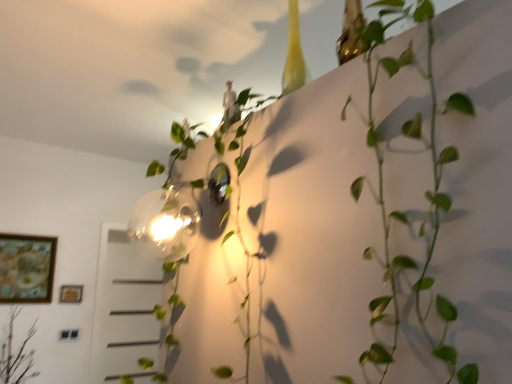
Question: Can you confirm if green leafy plant at upper center, the second plant positioned from the right, is thinner than wooden framed artwork at lower left, which is counted as the first picture frame, starting from the left?

Choices:
 (A) no
 (B) yes

Answer: (A)

Question: From a real-world perspective, is green leafy plant at upper center, the 2th plant positioned from the left, positioned under wooden framed artwork at lower left, placed as the 2th picture frame when sorted from right to left, based on gravity?

Choices:
 (A) yes
 (B) no

Answer: (B)

Question: From the image's perspective, is green leafy plant at upper center, the 2th plant positioned from the front, located above wooden framed artwork at lower left, placed as the 2th picture frame when sorted from right to left?

Choices:
 (A) no
 (B) yes

Answer: (B)

Question: Considering the relative positions of green leafy plant at upper center, the 2th plant positioned from the front, and wooden framed artwork at lower left, placed as the 2th picture frame when sorted from right to left, in the image provided, is green leafy plant at upper center, the 2th plant positioned from the front, in front of wooden framed artwork at lower left, placed as the 2th picture frame when sorted from right to left,?

Choices:
 (A) yes
 (B) no

Answer: (A)

Question: Is green leafy plant at upper center, the 2th plant positioned from the left, behind wooden framed artwork at lower left, which is counted as the first picture frame, starting from the left?

Choices:
 (A) no
 (B) yes

Answer: (A)

Question: Looking at their shapes, would you say gold metallic picture frame at lower left, which is the 2th picture frame in left-to-right order, is wider or thinner than green leafy plant at upper center, the 2th plant positioned from the left?

Choices:
 (A) wide
 (B) thin

Answer: (B)

Question: From a real-world perspective, is gold metallic picture frame at lower left, marked as the 1th picture frame in a right-to-left arrangement, positioned above or below green leafy plant at upper center, the 2th plant positioned from the left?

Choices:
 (A) above
 (B) below

Answer: (B)

Question: In the image, is gold metallic picture frame at lower left, marked as the 1th picture frame in a right-to-left arrangement, on the left side or the right side of green leafy plant at upper center, marked as the second plant in a back-to-front arrangement?

Choices:
 (A) left
 (B) right

Answer: (A)

Question: Is point (71, 301) positioned closer to the camera than point (237, 178)?

Choices:
 (A) closer
 (B) farther

Answer: (B)

Question: Does point (394, 306) appear closer or farther from the camera than point (74, 299)?

Choices:
 (A) farther
 (B) closer

Answer: (B)

Question: From the image's perspective, is green matte plant at upper right, marked as the 3th plant in a left-to-right arrangement, located above or below gold metallic picture frame at lower left, which is the 2th picture frame in left-to-right order?

Choices:
 (A) below
 (B) above

Answer: (B)

Question: Is green matte plant at upper right, which ranks as the 3th plant in back-to-front order, wider or thinner than gold metallic picture frame at lower left, which is the 2th picture frame in left-to-right order?

Choices:
 (A) wide
 (B) thin

Answer: (A)

Question: In terms of height, does green matte plant at upper right, the first plant from the right, look taller or shorter compared to gold metallic picture frame at lower left, marked as the 1th picture frame in a right-to-left arrangement?

Choices:
 (A) short
 (B) tall

Answer: (B)

Question: Relative to wooden framed artwork at lower left, which is counted as the first picture frame, starting from the left, is green matte plant at lower left, which is the 1th plant in back-to-front order, in front or behind?

Choices:
 (A) behind
 (B) front

Answer: (B)

Question: Considering the positions of point (17, 355) and point (7, 241), is point (17, 355) closer or farther from the camera than point (7, 241)?

Choices:
 (A) farther
 (B) closer

Answer: (B)